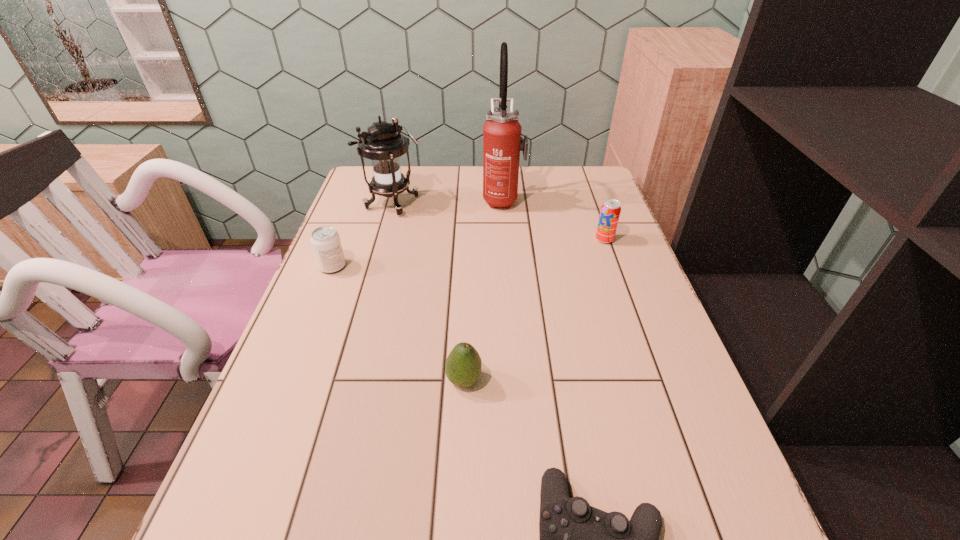
Locate an element on the screen. The height and width of the screenshot is (540, 960). vacant area that lies between the fire extinguisher and the farther soda can is located at coordinates (554, 219).

You are a GUI agent. You are given a task and a screenshot of the screen. Output one action in this format:
    pyautogui.click(x=<x>, y=<y>)
    Task: Click on the free spot between the tallest object and the nearer soda can
    
    Given the screenshot: What is the action you would take?
    (x=418, y=233)

What are the coordinates of `free space between the nearer soda can and the tallest object` in the screenshot? It's located at (418, 233).

Select which object is the second closest to the nearest object. Please provide its 2D coordinates. Your answer should be formatted as a tuple, i.e. [(x, y)], where the tuple contains the x and y coordinates of a point satisfying the conditions above.

[(610, 211)]

Find the location of a particular element. The height and width of the screenshot is (540, 960). object that stands as the third closest to the control is located at coordinates (325, 240).

Identify the location of free point that satisfies the following two spatial constraints: 1. on the back side of the rightmost object; 2. at the nozzle of the fire extinguisher. (589, 199).

Image resolution: width=960 pixels, height=540 pixels. Identify the location of vacant region that satisfies the following two spatial constraints: 1. on the back side of the rightmost object; 2. on the left side of the left soda can. (343, 240).